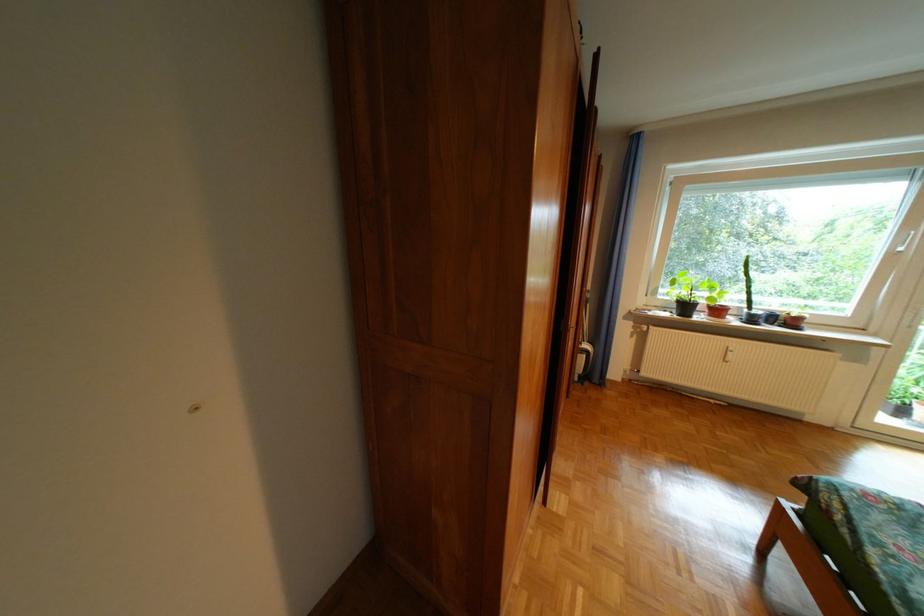
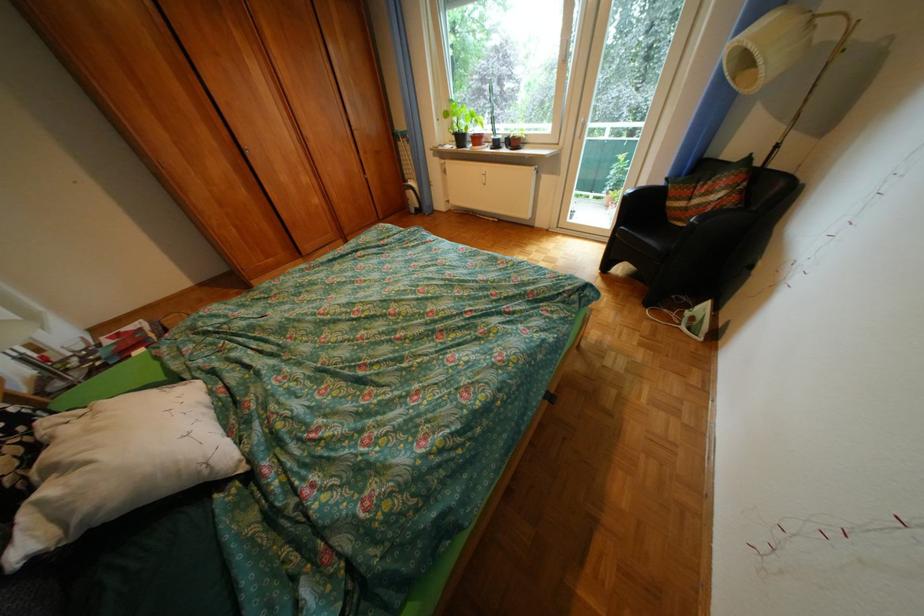
The images are taken continuously from a first-person perspective. In which direction are you moving?

The cameraman moved toward right, backward.